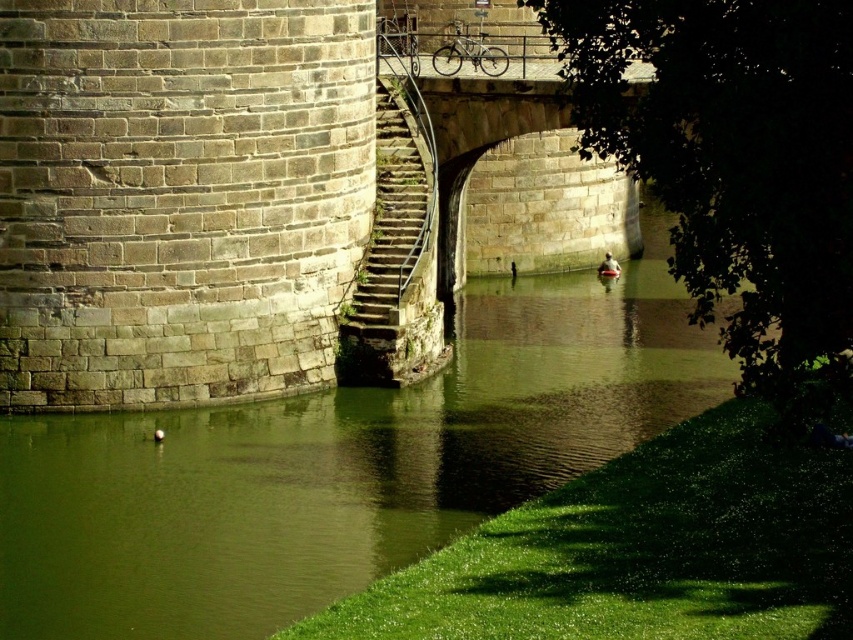
Question: Considering the relative positions of green stone river at center and stone textured stairs at center in the image provided, where is green stone river at center located with respect to stone textured stairs at center?

Choices:
 (A) right
 (B) left

Answer: (A)

Question: Is green stone river at center smaller than stone textured stairs at center?

Choices:
 (A) no
 (B) yes

Answer: (A)

Question: Considering the relative positions of green stone river at center and stone textured stairs at center in the image provided, where is green stone river at center located with respect to stone textured stairs at center?

Choices:
 (A) above
 (B) below

Answer: (B)

Question: Which point is farther to the camera?

Choices:
 (A) green stone river at center
 (B) stone textured stairs at center

Answer: (B)

Question: Which point is closer to the camera?

Choices:
 (A) (393, 300)
 (B) (323, 563)

Answer: (B)

Question: Which of the following is the closest to the observer?

Choices:
 (A) stone textured stairs at center
 (B) green stone river at center

Answer: (B)